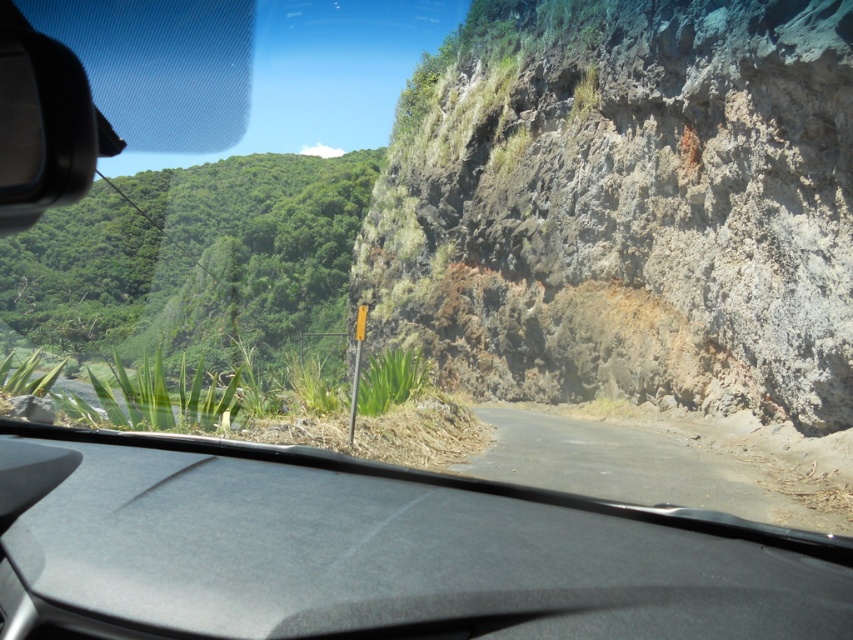
You are driving a car with a 5 meter long trailer attached to it. You see the rusty rock cliff at right. Can you safely make a U turn here without hitting the cliff?

The distance between the rusty rock cliff at right and the camera is 10.78 meters. Since the trailer is 5 meters long, the total length of the car plus trailer is likely more than 5 meters. However, the distance available is 10.78 meters. If the turning radius requires at least 10 meters, there might be just enough space. But this depends on the exact dimensions of the vehicle and trailer. It is risky but possible if executed carefully.

Consider the image. You are driving a car with a trunk that is 6 feet long. You want to park your car so that the trunk is facing the rusty rock cliff at right. Can you safely park the car without the trunk hitting the cliff if the car is currently positioned with the black matte dashboard at center facing forward?

The distance between the rusty rock cliff at right and the black matte dashboard at center is 73.18 feet. Since the trunk is only 6 feet long, there is more than enough space to park safely without hitting the cliff.

You are driving a car with a 1.8 meter wide trunk. You need to park your car so that the trunk faces the cliff. The point on the cliff closest to your car is point (161, 582). Can you safely park your car without the trunk overhanging the cliff edge?

The point on the cliff closest to your car is 2.10 meters away. Since the trunk is 1.8 meters wide, you can park safely as the distance is greater than the trunk width, so no overhang occurs.